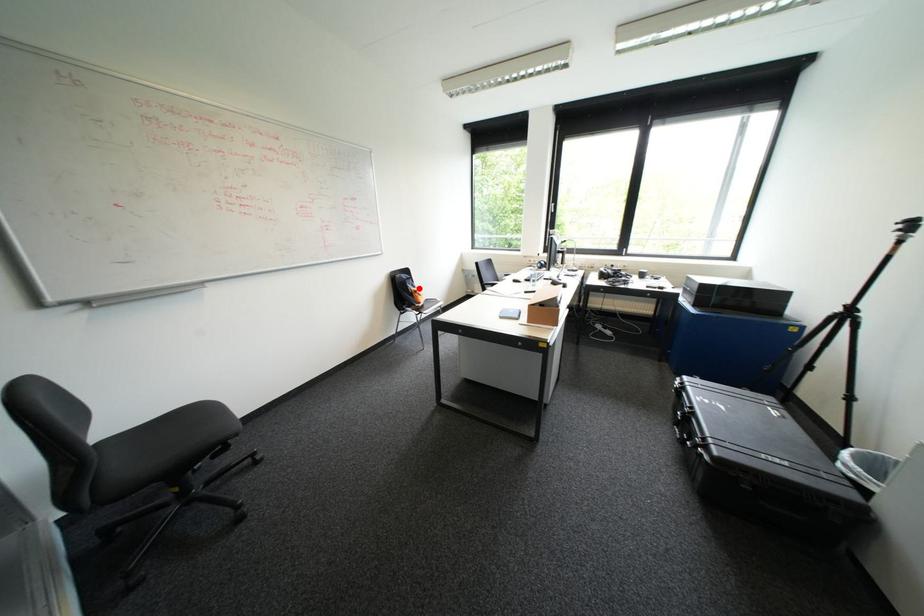
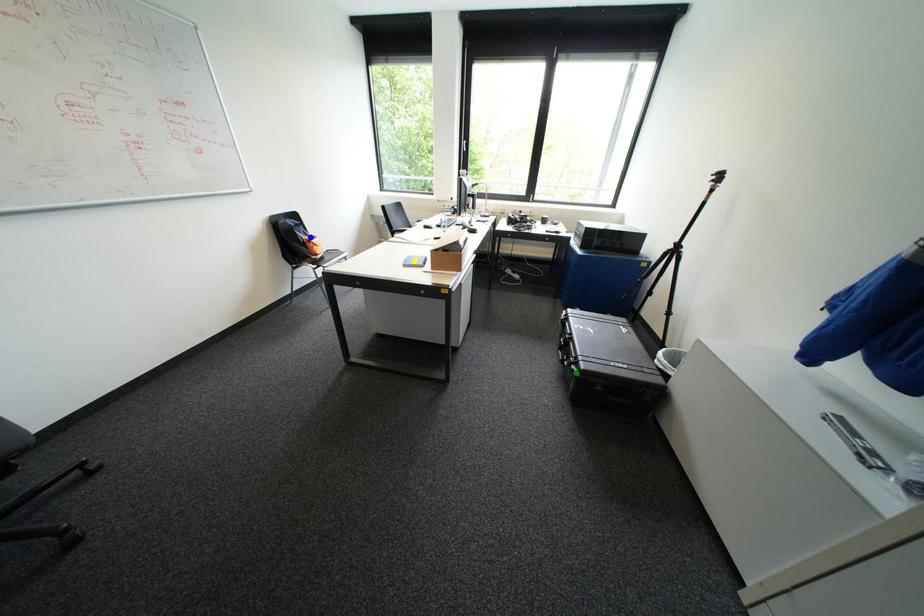
Question: I am providing you with two images of the same scene from different viewpoints. A red point is marked on the first image. You are given multiple points on the second image. Which point in image 2 is actually the same real-world point as the red point in image 1?

Choices:
 (A) yellow point
 (B) blue point
 (C) green point

Answer: (B)